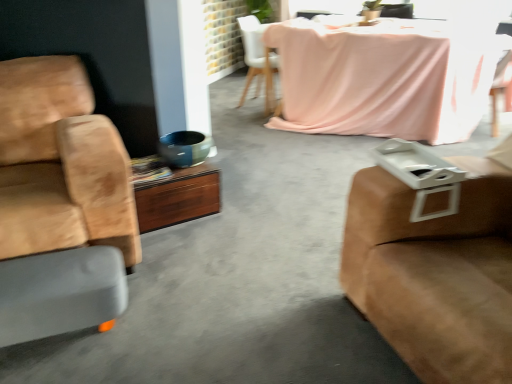
I want to click on free space above gray rubber footrest at lower left (from a real-world perspective), so click(51, 274).